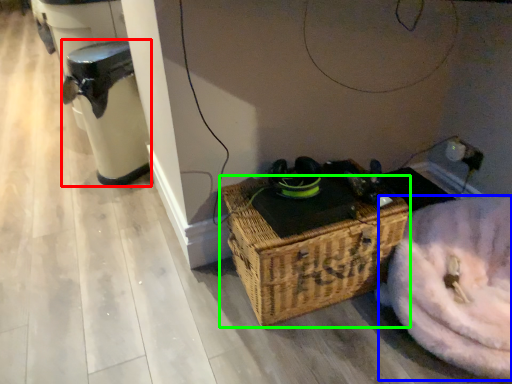
Question: Estimate the real-world distances between objects in this image. Which object is closer to water heater (highlighted by a red box), washer (highlighted by a blue box) or picnic basket (highlighted by a green box)?

Choices:
 (A) washer
 (B) picnic basket

Answer: (B)